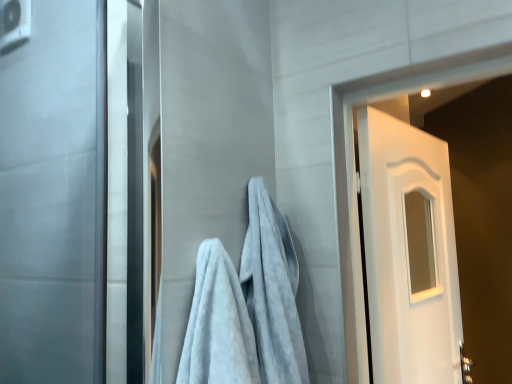
At what (x,y) coordinates should I click in order to perform the action: click on white glossy door at right. Please return your answer as a coordinate pair (x, y). The image size is (512, 384). Looking at the image, I should click on (409, 252).

Measure the distance between white glossy door at right and camera.

A: white glossy door at right and camera are 1.32 meters apart from each other.

Measure the distance between point (442, 357) and camera.

The depth of point (442, 357) is 1.69 meters.

The width and height of the screenshot is (512, 384). What do you see at coordinates (409, 252) in the screenshot? I see `white glossy door at right` at bounding box center [409, 252].

The height and width of the screenshot is (384, 512). Find the location of `white glossy door at right`. white glossy door at right is located at coordinates (409, 252).